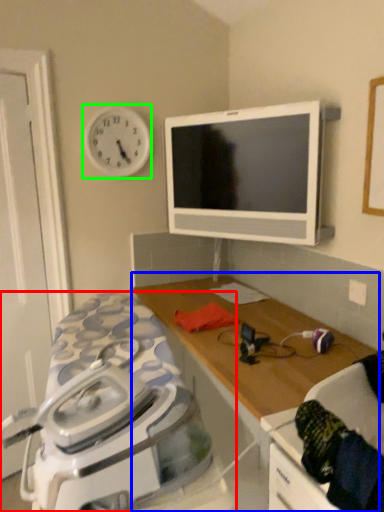
Question: Considering the real-world distances, which object is closest to home appliance (highlighted by a red box)? table (highlighted by a blue box) or clock (highlighted by a green box).

Choices:
 (A) table
 (B) clock

Answer: (A)